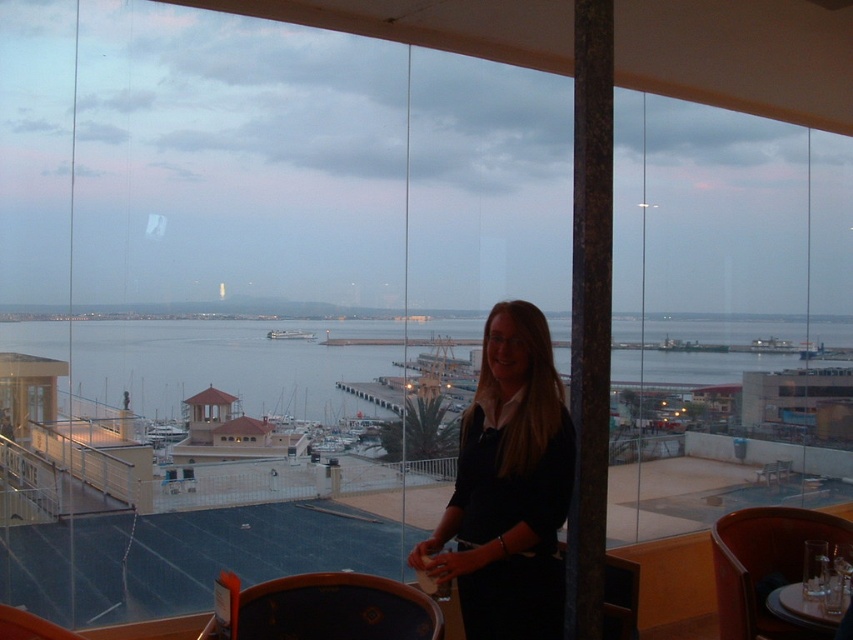
You are a photographer standing on the balcony. You notice the blue water at center and the black matte shirt at center. Which object is closer to the camera?

The black matte shirt at center is closer to the camera because it is taller than the blue water at center, indicating it occupies a more foreground position.

You are a photographer standing at the center of the balcony. You want to take a picture of the black matte shirt at center. Where should you aim your camera?

You should aim your camera at point [508,486] to capture the black matte shirt at center.